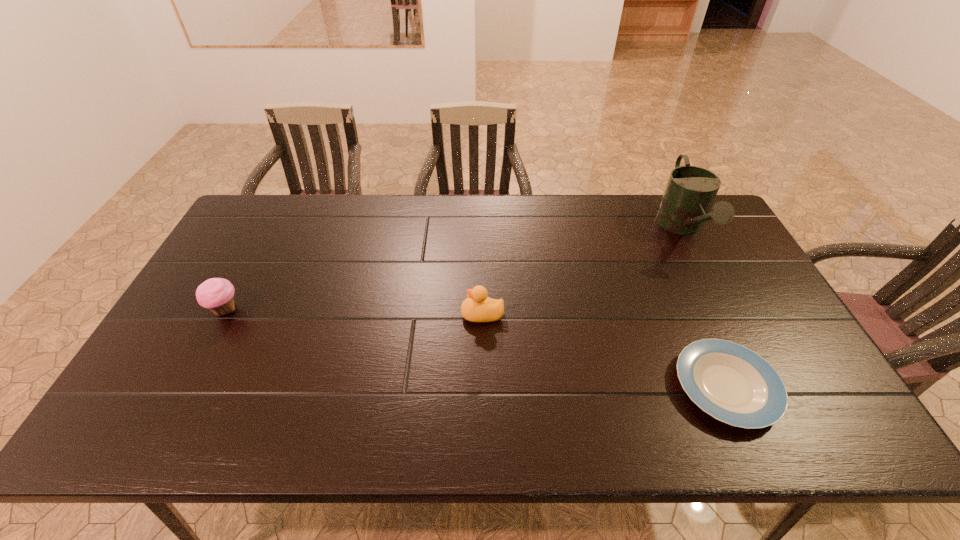
Identify the location of free region at the near edge of the desktop. This screenshot has height=540, width=960. (435, 422).

The image size is (960, 540). I want to click on free space at the left edge, so click(173, 398).

Locate an element on the screen. vacant area between the duck and the shortest object is located at coordinates 604,350.

Locate an element on the screen. free space between the second object from left to right and the cupcake is located at coordinates (354, 312).

Where is `blank region between the farthest object and the plate`? This screenshot has height=540, width=960. blank region between the farthest object and the plate is located at coordinates pyautogui.click(x=705, y=308).

You are a GUI agent. You are given a task and a screenshot of the screen. Output one action in this format:
    pyautogui.click(x=<x>, y=<y>)
    Task: Click on the vacant area that lies between the watering can and the leftmost object
    
    Given the screenshot: What is the action you would take?
    pyautogui.click(x=454, y=269)

Identify the location of vacant space that's between the tallest object and the duck. The image size is (960, 540). (583, 272).

Image resolution: width=960 pixels, height=540 pixels. Find the location of `free point between the shortest object and the second object from left to right`. free point between the shortest object and the second object from left to right is located at coordinates (604, 350).

Where is `free space between the watering can and the leftmost object`? Image resolution: width=960 pixels, height=540 pixels. free space between the watering can and the leftmost object is located at coordinates (454, 269).

Where is `free space between the plate and the duck`? The height and width of the screenshot is (540, 960). free space between the plate and the duck is located at coordinates (604, 350).